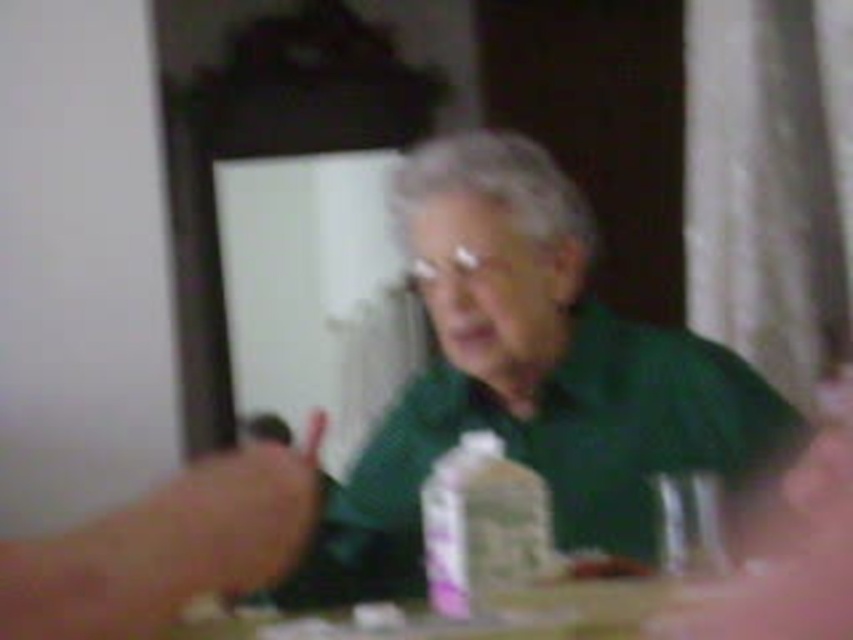
Does green matte shirt at center have a lesser height compared to wooden table at center?

Incorrect, green matte shirt at center's height does not fall short of wooden table at center's.

Is green matte shirt at center above wooden table at center?

Indeed, green matte shirt at center is positioned over wooden table at center.

This screenshot has width=853, height=640. Find the location of `green matte shirt at center`. green matte shirt at center is located at coordinates (531, 378).